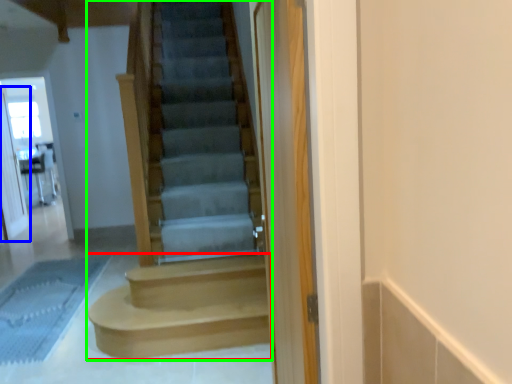
Question: Based on their relative distances, which object is farther from stairs (highlighted by a red box)? Choose from screen door (highlighted by a blue box) and stairs (highlighted by a green box).

Choices:
 (A) screen door
 (B) stairs

Answer: (A)